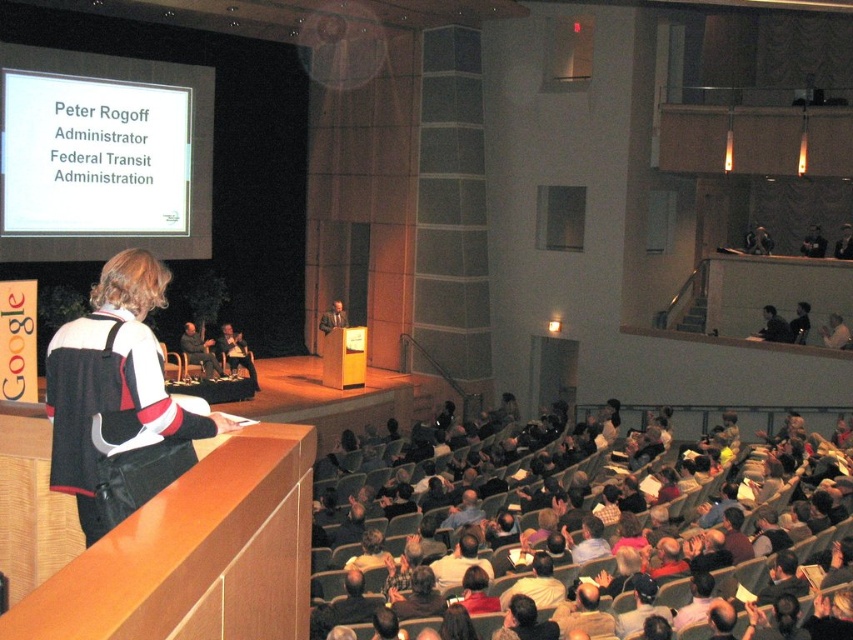
You are an attendee in the front row of the auditorium and want to approach the speaker. Since you can see both the dark gray suit at center and the matte black podium at center, which object should you walk towards to reach the speaker?

The speaker is wearing the dark gray suit at center, so you should walk towards the dark gray suit at center to reach the speaker.

You are sitting in the front row of the auditorium and notice two points marked on the stage. One is at coordinates point (207, 356) and the other at point (323, 314). Which point is closer to you?

Point (207, 356) is closer to the viewer than point (323, 314).